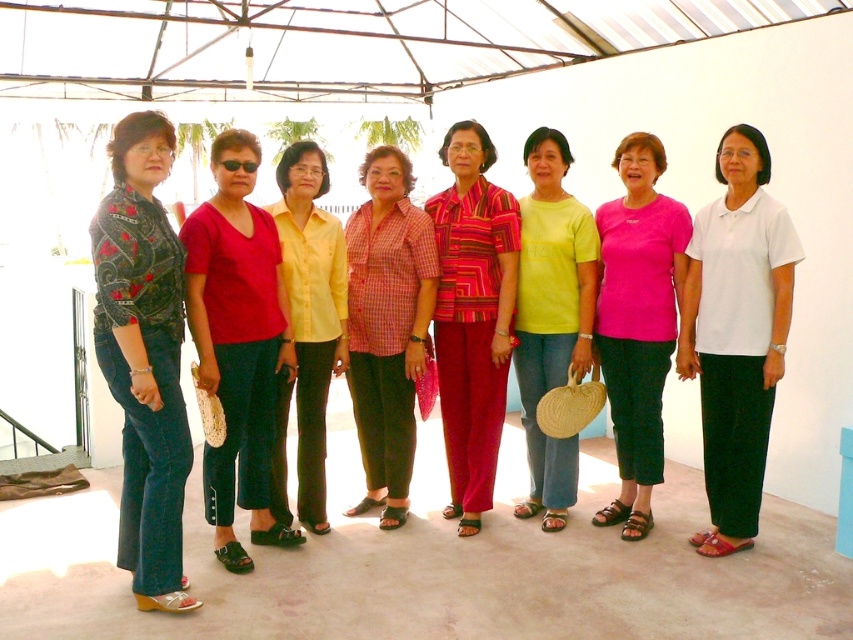
You are organizing a photo shoot and need to ensure that the patterned fabric blouse at left and the yellow matte shirt at center are visible in the frame. Given their sizes, which one might require more space in the composition?

The patterned fabric blouse at left is larger in size compared to the yellow matte shirt at center, so it might require more space in the composition.

You are a photographer trying to capture a photo of the two women wearing the patterned fabric blouse at left and the pink fabric shirt at center. Since you want both subjects to be in the frame, which direction should you move your camera to include both?

The patterned fabric blouse at left is to the left of the pink fabric shirt at center, so you should move your camera to the left to include both subjects in the frame.

You are a photographer taking a picture of the group. To ensure both the patterned fabric blouse at left and the yellow matte shirt at center are clearly visible in the photo, which one should you focus on first?

The patterned fabric blouse at left is positioned under the yellow matte shirt at center, so focusing on the yellow matte shirt at center first will ensure both are in focus due to its higher position.